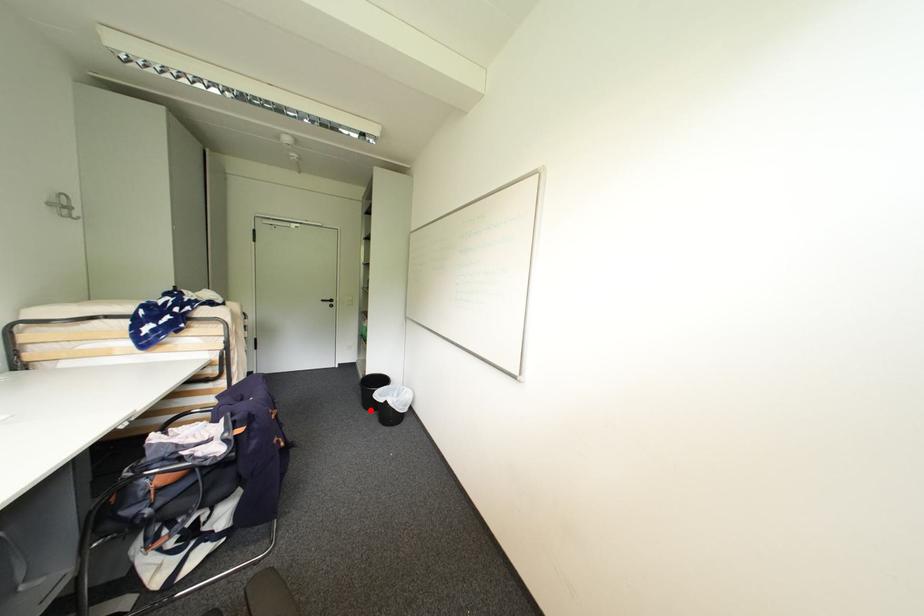
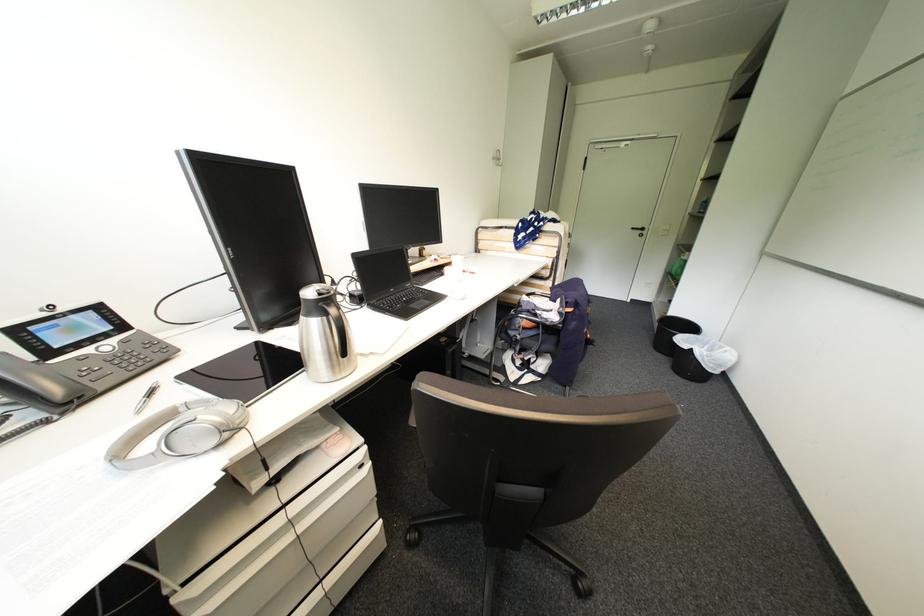
Question: A red point is marked in image1. In image2, is the corresponding 3D point closer to the camera or farther? Reply with the corresponding letter.

Choices:
 (A) The corresponding 3D point is closer.
 (B) The corresponding 3D point is farther.

Answer: (A)